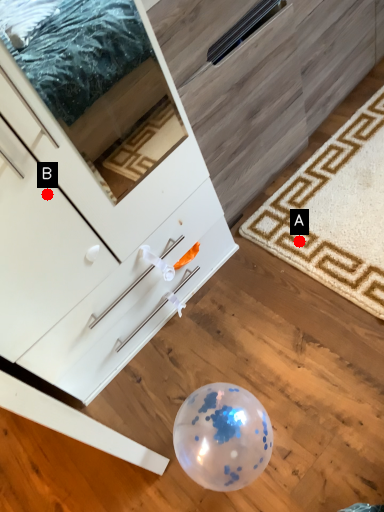
Question: Two points are circled on the image, labeled by A and B beside each circle. Which point is closer to the camera?

Choices:
 (A) A is closer
 (B) B is closer

Answer: (B)